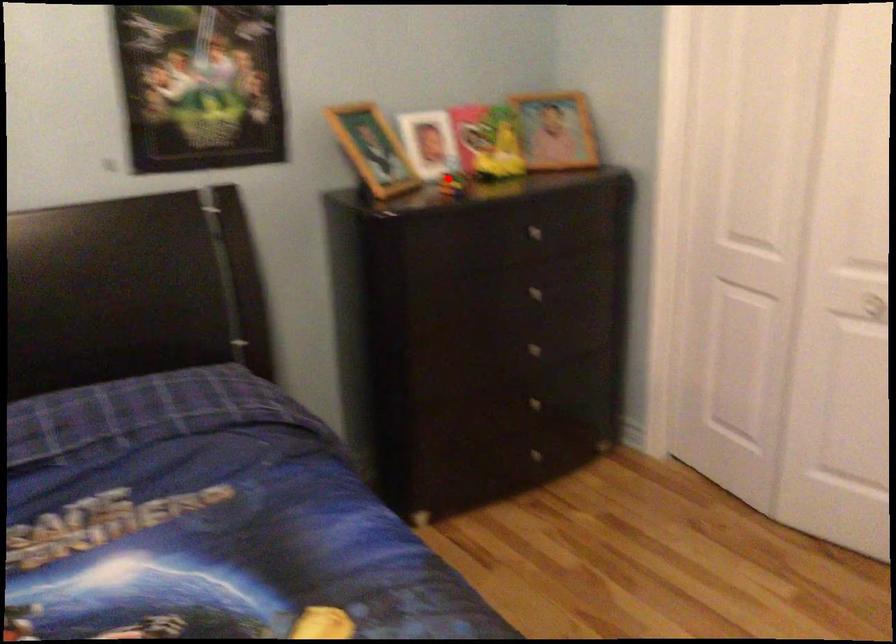
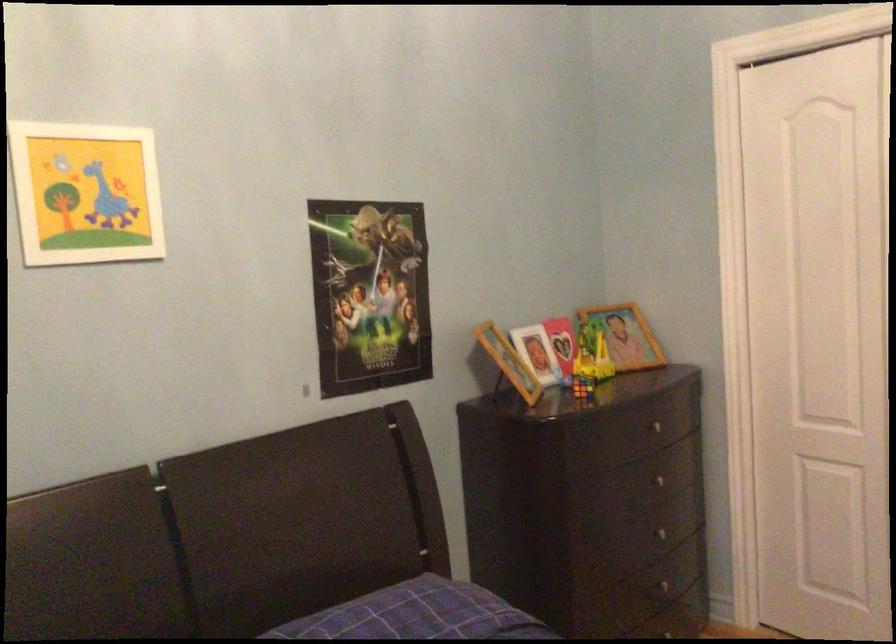
Where in the second image is the point corresponding to the highlighted location from the first image?

(582, 386)